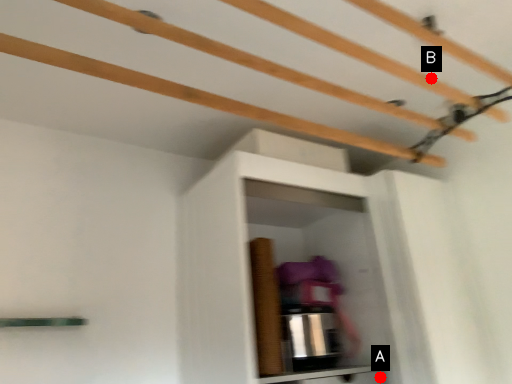
Question: Two points are circled on the image, labeled by A and B beside each circle. Which point is farther to the camera?

Choices:
 (A) A is further
 (B) B is further

Answer: (A)